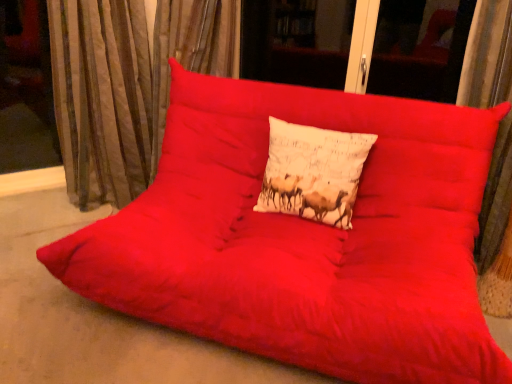
Question: From a real-world perspective, is white cotton cushion at center positioned above or below velvet-like brown curtain at left?

Choices:
 (A) below
 (B) above

Answer: (A)

Question: Considering the positions of white cotton cushion at center and velvet-like brown curtain at left in the image, is white cotton cushion at center wider or thinner than velvet-like brown curtain at left?

Choices:
 (A) wide
 (B) thin

Answer: (B)

Question: Considering the relative positions of white cotton cushion at center and velvet-like brown curtain at left in the image provided, is white cotton cushion at center to the left or to the right of velvet-like brown curtain at left?

Choices:
 (A) left
 (B) right

Answer: (B)

Question: Relative to white cotton cushion at center, is velvet-like brown curtain at left in front or behind?

Choices:
 (A) front
 (B) behind

Answer: (B)

Question: From the image's perspective, is velvet-like brown curtain at left positioned above or below white cotton cushion at center?

Choices:
 (A) below
 (B) above

Answer: (B)

Question: Looking at the image, does velvet-like brown curtain at left seem bigger or smaller compared to white cotton cushion at center?

Choices:
 (A) big
 (B) small

Answer: (A)

Question: From a real-world perspective, is velvet-like brown curtain at left above or below white cotton cushion at center?

Choices:
 (A) below
 (B) above

Answer: (B)